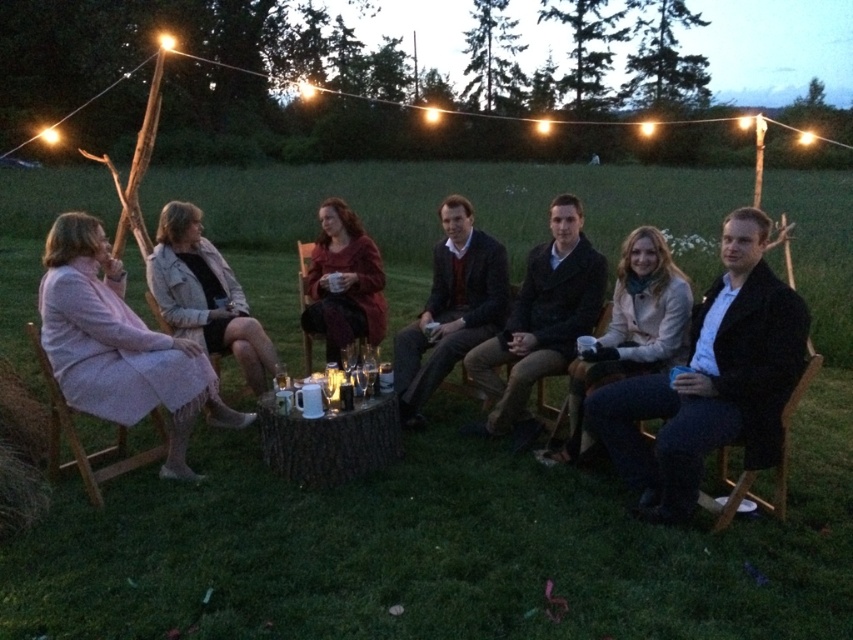
Question: Where is light pink fabric dress at left located in relation to light gray textured jacket at center in the image?

Choices:
 (A) above
 (B) below

Answer: (B)

Question: Based on their relative distances, which object is farther from the wooden chair at center?

Choices:
 (A) dark brown wool coat at center
 (B) light beige coat at center
 (C) wooden chair at right

Answer: (C)

Question: Which point is closer to the camera?

Choices:
 (A) (581, 435)
 (B) (807, 365)
 (C) (335, 326)
 (D) (187, 282)

Answer: (B)

Question: Does light beige coat at center have a lesser width compared to wooden chair at left?

Choices:
 (A) no
 (B) yes

Answer: (B)

Question: Which of the following is the farthest from the observer?

Choices:
 (A) (171, 268)
 (B) (732, 509)
 (C) (157, 452)

Answer: (A)

Question: Does dark brown leather jacket at center appear over light gray textured jacket at center?

Choices:
 (A) no
 (B) yes

Answer: (A)